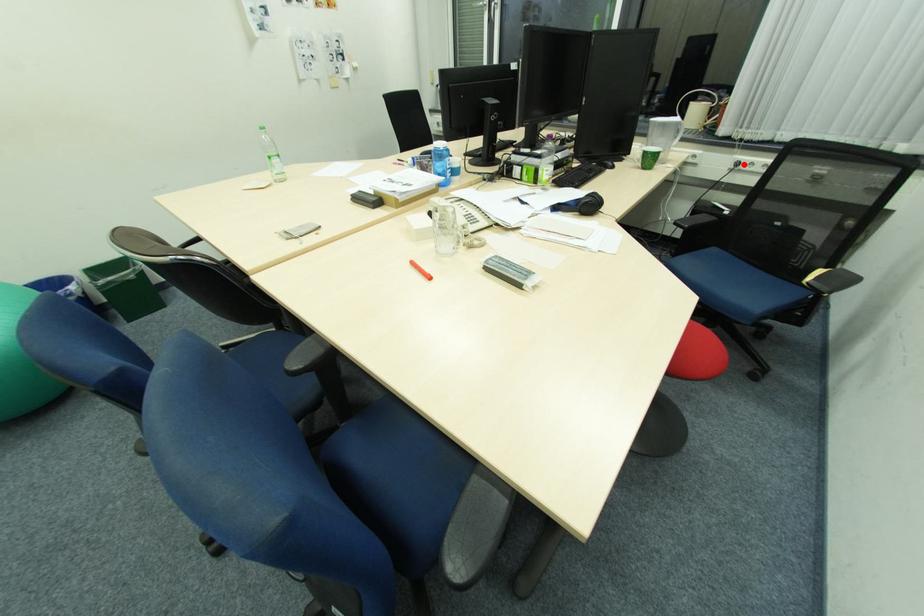
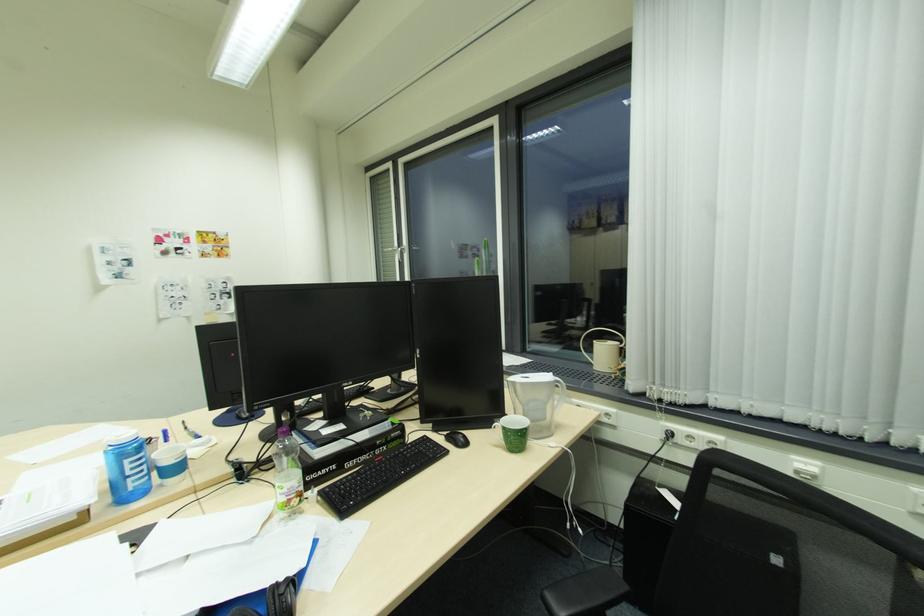
Question: I am providing you with two images of the same scene from different viewpoints. A red point is marked on the first image. At the location where the point appears in image 1, is it still visible in image 2?

Choices:
 (A) Yes
 (B) No

Answer: (A)